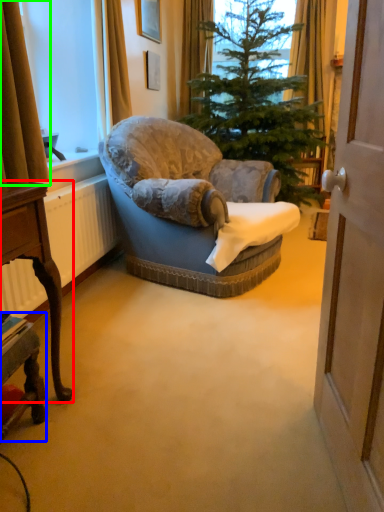
Question: Estimate the real-world distances between objects in this image. Which object is closer to desk (highlighted by a red box), desk (highlighted by a blue box) or curtain (highlighted by a green box)?

Choices:
 (A) desk
 (B) curtain

Answer: (A)